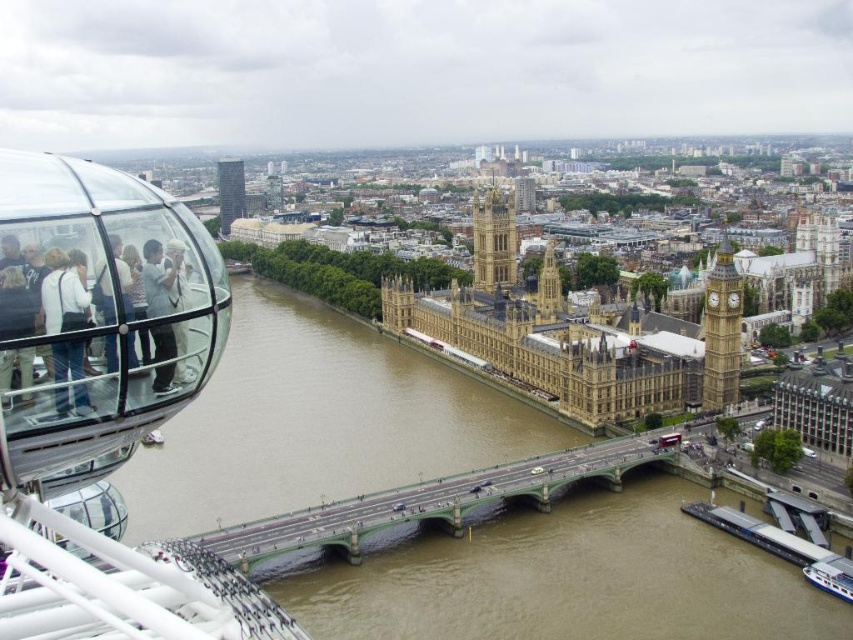
Question: Among these objects, which one is nearest to the camera?

Choices:
 (A) brown/muddy water at center
 (B) green metallic bridge at center
 (C) matte black jacket at left

Answer: (C)

Question: Among these objects, which one is nearest to the camera?

Choices:
 (A) matte glass people at left
 (B) golden stone clock tower at center
 (C) glassy transparent tower at upper left

Answer: (A)

Question: Among these points, which one is nearest to the camera?

Choices:
 (A) (178, 243)
 (B) (218, 161)
 (C) (509, 252)
 (D) (100, 275)

Answer: (D)

Question: Does gold stone clock tower at right come behind glassy transparent tower at upper left?

Choices:
 (A) yes
 (B) no

Answer: (B)

Question: Does matte glass people at left appear on the right side of matte black jacket at left?

Choices:
 (A) yes
 (B) no

Answer: (B)

Question: Is green metallic bridge at center in front of light blue denim jacket at left?

Choices:
 (A) no
 (B) yes

Answer: (A)